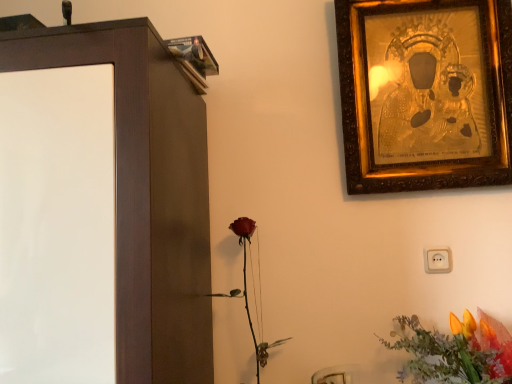
Question: Considering the relative sizes of vibrant orange petals at lower right and gold textured picture frame at upper right in the image provided, is vibrant orange petals at lower right taller than gold textured picture frame at upper right?

Choices:
 (A) yes
 (B) no

Answer: (B)

Question: Is vibrant orange petals at lower right bigger than gold textured picture frame at upper right?

Choices:
 (A) yes
 (B) no

Answer: (B)

Question: Is vibrant orange petals at lower right thinner than gold textured picture frame at upper right?

Choices:
 (A) no
 (B) yes

Answer: (A)

Question: Does vibrant orange petals at lower right have a lesser height compared to gold textured picture frame at upper right?

Choices:
 (A) no
 (B) yes

Answer: (B)

Question: From the image's perspective, is vibrant orange petals at lower right on gold textured picture frame at upper right?

Choices:
 (A) yes
 (B) no

Answer: (B)

Question: Does vibrant orange petals at lower right appear on the right side of gold textured picture frame at upper right?

Choices:
 (A) yes
 (B) no

Answer: (A)

Question: Does matte red rose at center have a lesser height compared to gold textured picture frame at upper right?

Choices:
 (A) no
 (B) yes

Answer: (B)

Question: Is matte red rose at center not near gold textured picture frame at upper right?

Choices:
 (A) no
 (B) yes

Answer: (A)

Question: Considering the relative sizes of matte red rose at center and gold textured picture frame at upper right in the image provided, is matte red rose at center bigger than gold textured picture frame at upper right?

Choices:
 (A) yes
 (B) no

Answer: (B)

Question: From the image's perspective, would you say matte red rose at center is positioned over gold textured picture frame at upper right?

Choices:
 (A) yes
 (B) no

Answer: (B)

Question: Does matte red rose at center touch gold textured picture frame at upper right?

Choices:
 (A) no
 (B) yes

Answer: (A)

Question: Considering the relative positions of matte red rose at center and gold textured picture frame at upper right in the image provided, is matte red rose at center behind gold textured picture frame at upper right?

Choices:
 (A) yes
 (B) no

Answer: (B)

Question: Could you tell me if gold textured picture frame at upper right is facing matte red rose at center?

Choices:
 (A) yes
 (B) no

Answer: (B)